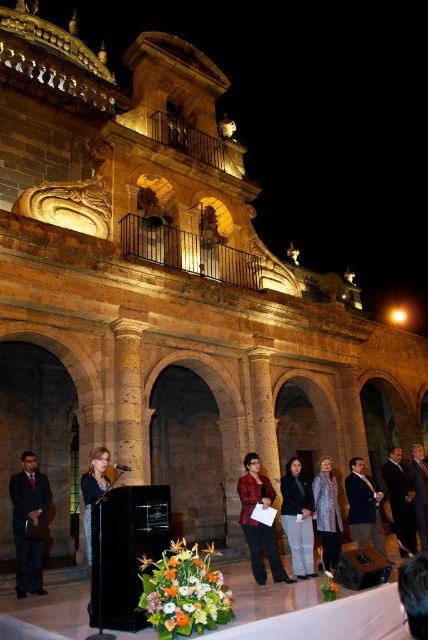
You are organizing a photo shoot and need to know the relative sizes of the dark suit at left and the shiny metallic coat at center. Which one is larger?

The dark suit at left is bigger than the shiny metallic coat at center.

You are standing at the front of the podium and need to pass a document to the person wearing the matte black jacket at center and the dark blue suit at center. Since you can only reach 2 meters, can you hand it to both without moving from your spot?

The matte black jacket at center is 6.35 meters away from dark blue suit at center. Since you can only reach 2 meters, you cannot hand the document to both without moving from your spot because the distance between them is greater than your reach.